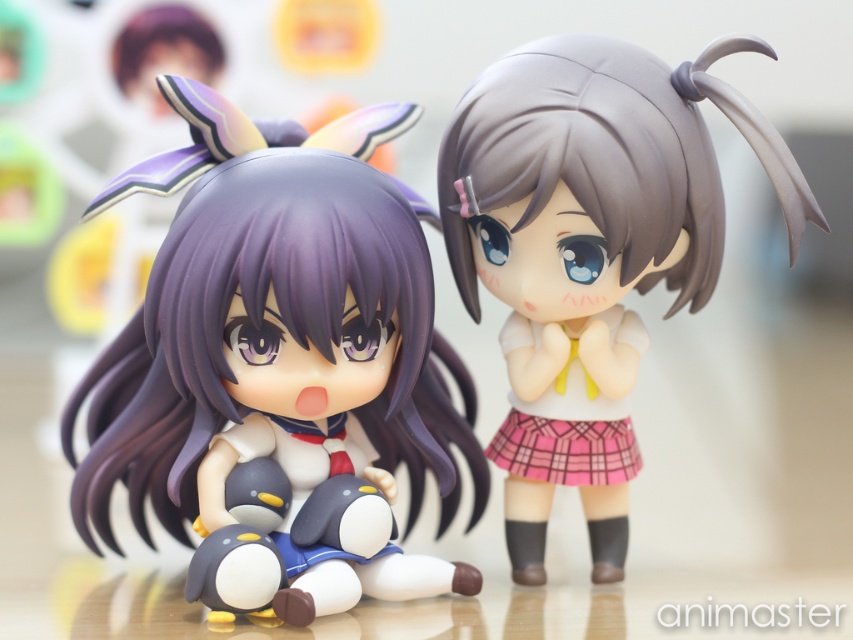
Question: Which object is farther from the camera taking this photo?

Choices:
 (A) satin gray doll at center
 (B) satin purple doll at center

Answer: (A)

Question: Which point is farther from the camera taking this photo?

Choices:
 (A) (616, 372)
 (B) (254, 577)

Answer: (A)

Question: Does satin purple doll at center appear over satin gray doll at center?

Choices:
 (A) yes
 (B) no

Answer: (B)

Question: Does satin purple doll at center have a greater width compared to satin gray doll at center?

Choices:
 (A) yes
 (B) no

Answer: (A)

Question: Does satin purple doll at center lie in front of satin gray doll at center?

Choices:
 (A) no
 (B) yes

Answer: (B)

Question: Among these points, which one is nearest to the camera?

Choices:
 (A) (578, 285)
 (B) (300, 442)

Answer: (A)